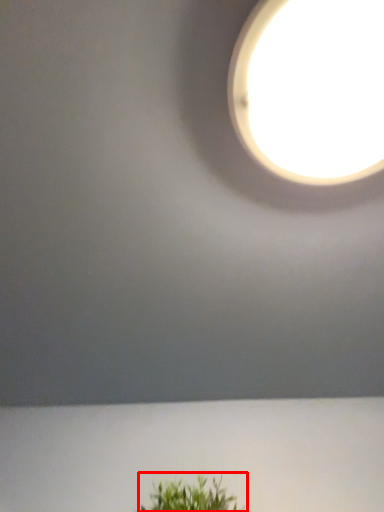
Question: From the image's perspective, what is the correct spatial relationship of houseplant (annotated by the red box) in relation to lamp?

Choices:
 (A) below
 (B) above

Answer: (A)